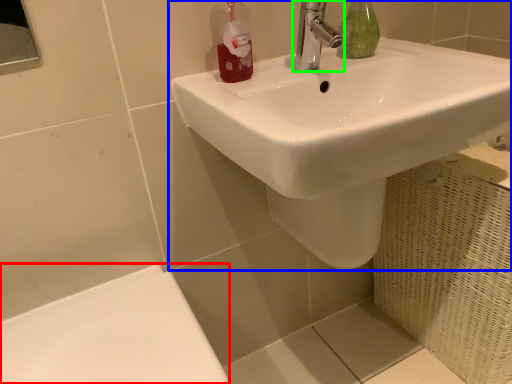
Question: Which object is positioned closest to porcelain (highlighted by a red box)? Select from sink (highlighted by a blue box) and tap (highlighted by a green box).

Choices:
 (A) sink
 (B) tap

Answer: (A)